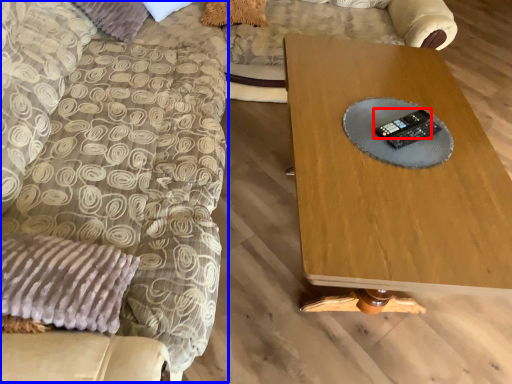
Question: Which point is further to the camera, control (highlighted by a red box) or swivel chair (highlighted by a blue box)?

Choices:
 (A) control
 (B) swivel chair

Answer: (A)